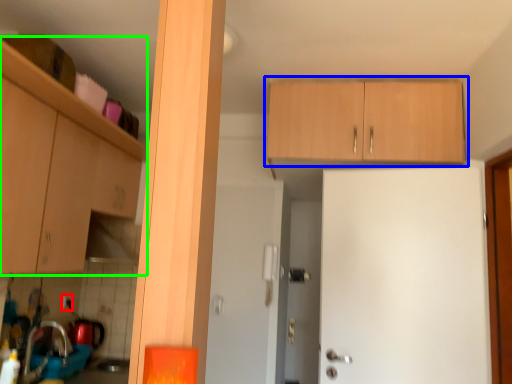
Question: Based on their relative distances, which object is farther from electric outlet (highlighted by a red box)? Choose from cabinetry (highlighted by a blue box) and cabinetry (highlighted by a green box).

Choices:
 (A) cabinetry
 (B) cabinetry

Answer: (A)